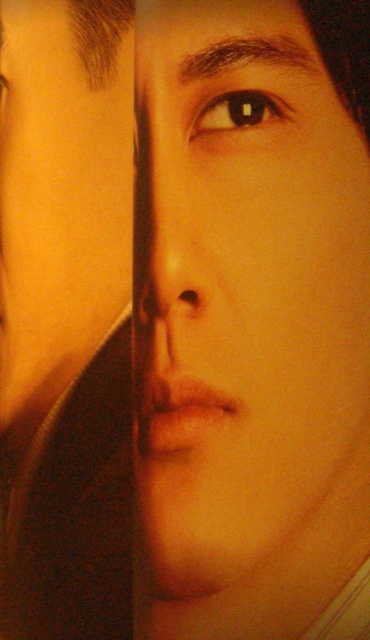
Measure the distance between point (368, 388) and camera.

The distance of point (368, 388) from camera is 28.99 inches.

Which of these two, smooth skin face at center or brown glossy eye at upper center, stands shorter?

brown glossy eye at upper center is shorter.

Who is more distant from viewer, (360, 225) or (236, 93)?

Positioned behind is point (236, 93).

Image resolution: width=370 pixels, height=640 pixels. What are the coordinates of `smooth skin face at center` in the screenshot? It's located at (241, 282).